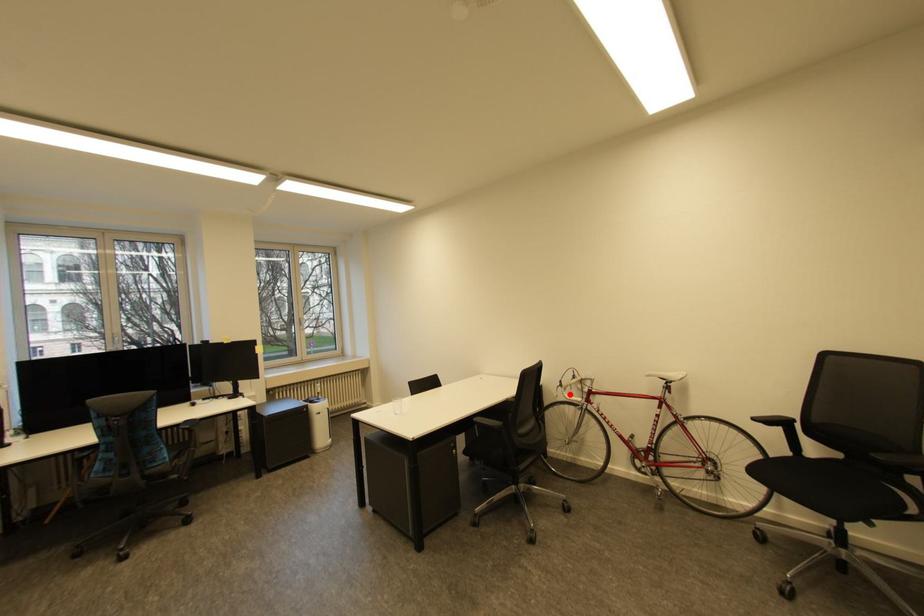
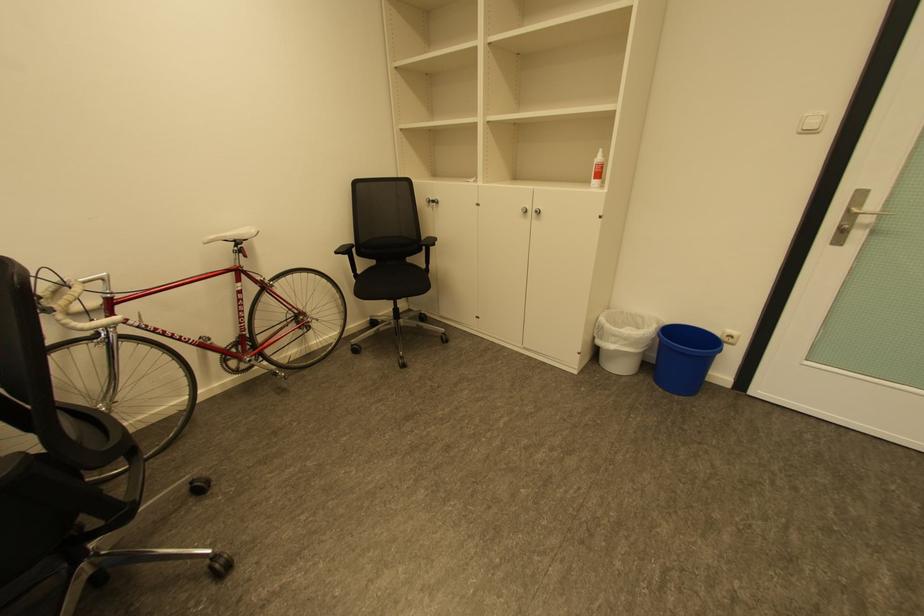
Find the pixel in the second image that matches the highlighted location in the first image.

(70, 326)